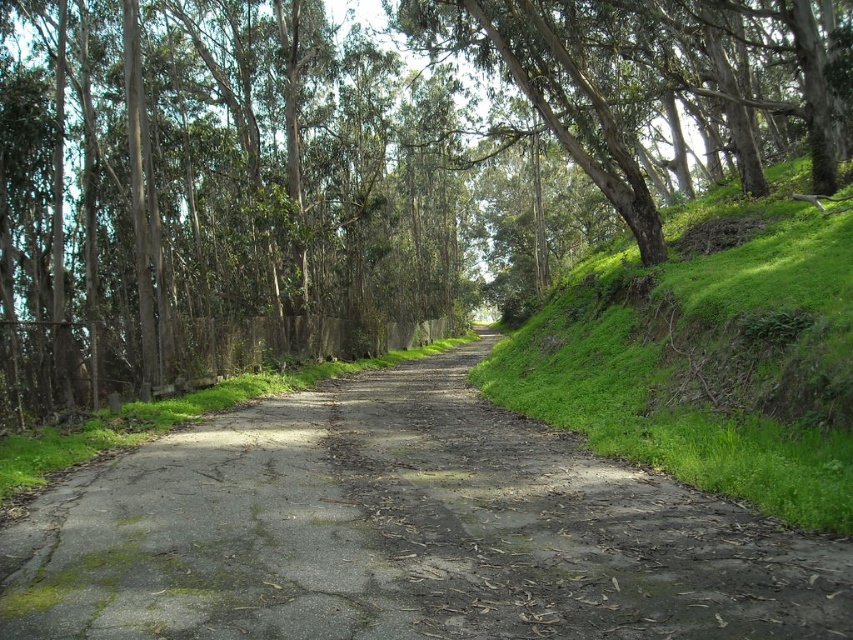
You are a hiker trying to navigate the narrow road. You notice a green leafy tree at center and a dull gray asphalt at center. Which object takes up more space in the image?

The green leafy tree at center is larger in size than the dull gray asphalt at center, so it takes up more space in the image.